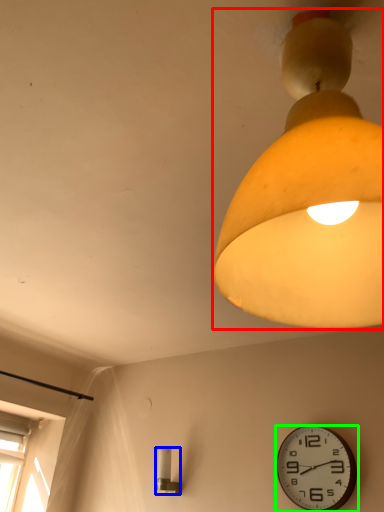
Question: Based on their relative distances, which object is nearer to lamp (highlighted by a red box)? Choose from lamp (highlighted by a blue box) and wall clock (highlighted by a green box).

Choices:
 (A) lamp
 (B) wall clock

Answer: (B)